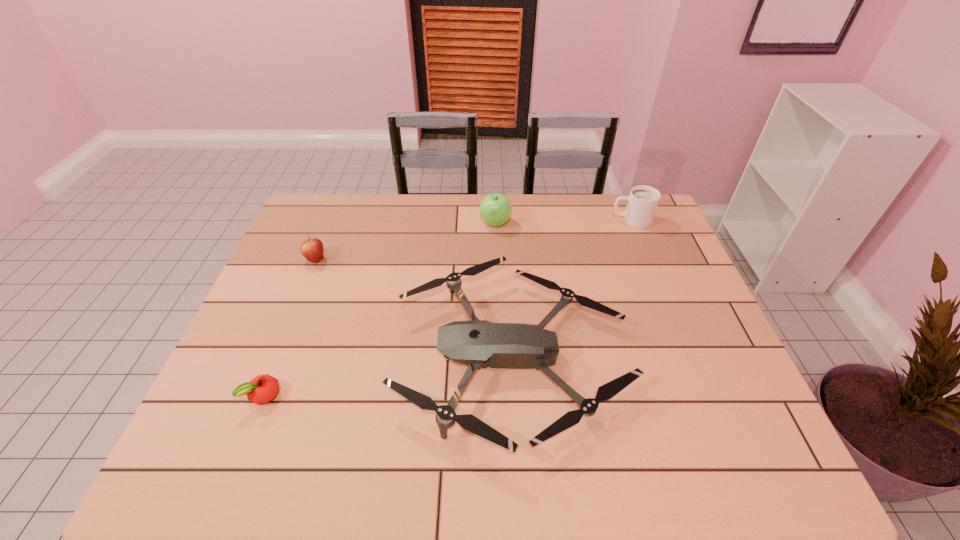
This screenshot has height=540, width=960. What are the coordinates of `the farthest apple` in the screenshot? It's located at (495, 210).

The width and height of the screenshot is (960, 540). Identify the location of the rightmost object. (643, 200).

Where is `the second farthest apple`? The width and height of the screenshot is (960, 540). the second farthest apple is located at coordinates (312, 249).

Find the location of a particular element. drone is located at coordinates (478, 342).

Find the location of a particular element. the nearest apple is located at coordinates (262, 389).

Identify the location of the shortest apple. The width and height of the screenshot is (960, 540). (262, 389).

Locate an element on the screen. This screenshot has width=960, height=540. vacant space situated 0.090m on the left of the farthest apple is located at coordinates (453, 223).

The width and height of the screenshot is (960, 540). I want to click on vacant space located 0.050m on the side with the handle of the cappuccino, so click(596, 220).

You are a GUI agent. You are given a task and a screenshot of the screen. Output one action in this format:
    pyautogui.click(x=<x>, y=<y>)
    Task: Click on the vacant space located 0.260m on the side with the handle of the cappuccino
    
    Given the screenshot: What is the action you would take?
    pyautogui.click(x=534, y=220)

Identify the location of vacant space located 0.360m on the side with the handle of the cappuccino. (505, 220).